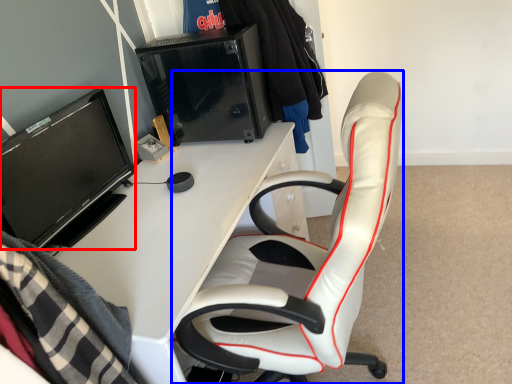
Question: Which object appears farthest to the camera in this image, television (highlighted by a red box) or chair (highlighted by a blue box)?

Choices:
 (A) television
 (B) chair

Answer: (A)